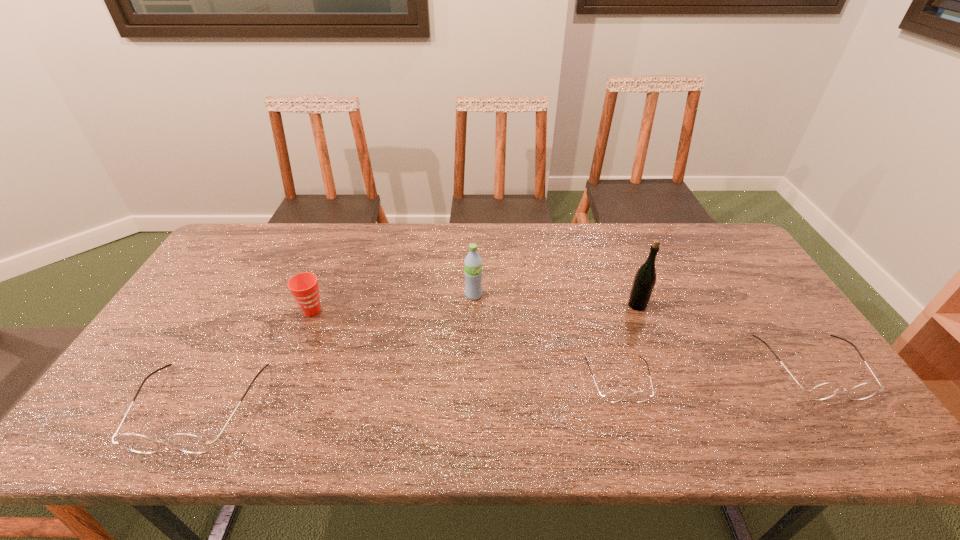
Please mark a free spot for a new spectacles to balance the arrangement. Please provide its 2D coordinates. Your answer should be formatted as a tuple, i.e. [(x, y)], where the tuple contains the x and y coordinates of a point satisfying the conditions above.

[(414, 393)]